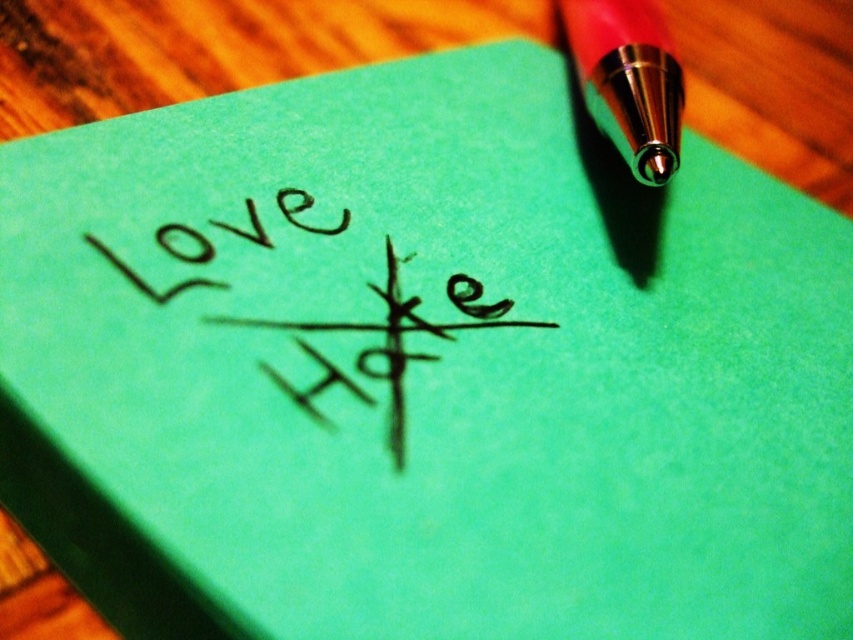
Question: Estimate the real-world distances between objects in this image. Which object is closer to the red metallic pen tip at upper right?

Choices:
 (A) black ink writing at center
 (B) matte black writing at upper left

Answer: (A)

Question: Does black ink writing at center lie in front of matte black writing at upper left?

Choices:
 (A) no
 (B) yes

Answer: (B)

Question: Which object is the closest to the red metallic pen tip at upper right?

Choices:
 (A) black ink writing at center
 (B) matte black writing at upper left

Answer: (A)

Question: Does red metallic pen tip at upper right have a larger size compared to matte black writing at upper left?

Choices:
 (A) no
 (B) yes

Answer: (B)

Question: Which is farther from the black ink writing at center?

Choices:
 (A) red metallic pen tip at upper right
 (B) matte black writing at upper left

Answer: (A)

Question: Can you confirm if black ink writing at center is positioned below matte black writing at upper left?

Choices:
 (A) yes
 (B) no

Answer: (A)